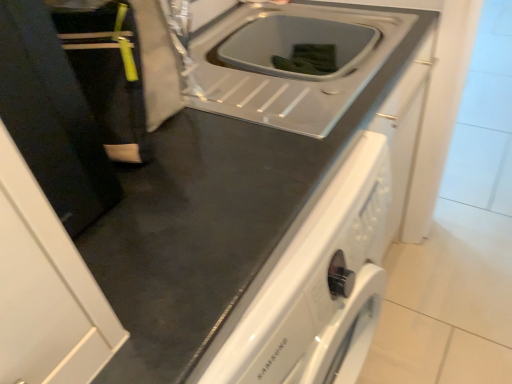
Identify the location of black fabric at left. The image size is (512, 384). (108, 74).

Locate an element on the screen. black fabric at left is located at coordinates (108, 74).

The width and height of the screenshot is (512, 384). In order to click on sink beneath the black fabric at left (from a real-world perspective) in this screenshot , I will do `click(292, 53)`.

Which object is thinner, black fabric at left or white glossy sink at center?

Thinner between the two is black fabric at left.

Would you say black fabric at left is inside or outside white glossy sink at center?

The correct answer is: outside.

Looking at this image, is black fabric at left oriented away from white glossy sink at center?

No, black fabric at left is not facing the opposite direction of white glossy sink at center.

In the image, is black matte door at left positioned in front of or behind black fabric at left?

black matte door at left is positioned closer to the viewer than black fabric at left.

Between black matte door at left and black fabric at left, which one has more height?

black matte door at left is taller.

Does black matte door at left turn towards black fabric at left?

No, black matte door at left does not turn towards black fabric at left.

Could black fabric at left be considered to be inside black matte door at left?

No, black fabric at left is located outside of black matte door at left.

Is black matte door at left to the left of white glossy sink at center from the viewer's perspective?

Yes.

From a real-world perspective, who is located higher, black matte door at left or white glossy sink at center?

black matte door at left is physically above.

Is black matte door at left smaller than white glossy sink at center?

Yes, black matte door at left is smaller than white glossy sink at center.

Is black matte door at left oriented towards white glossy sink at center?

No.

Which point is more distant from viewer, [95,90] or [24,157]?

The point [95,90] is more distant.

Visually, is black fabric at left positioned to the left or to the right of black matte door at left?

From the image, it's evident that black fabric at left is to the right of black matte door at left.

From a real-world perspective, is black fabric at left beneath black matte door at left?

Correct, in the physical world, black fabric at left is lower than black matte door at left.

Is black fabric at left further to the viewer compared to black matte door at left?

Yes, it is behind black matte door at left.

From the image's perspective, who appears lower, white glossy sink at center or black fabric at left?

black fabric at left is shown below in the image.

How different are the orientations of white glossy sink at center and black fabric at left in degrees?

The facing directions of white glossy sink at center and black fabric at left are 1.5 degrees apart.

Considering the relative sizes of white glossy sink at center and black fabric at left in the image provided, is white glossy sink at center taller than black fabric at left?

Incorrect, the height of white glossy sink at center is not larger of that of black fabric at left.

Which object is wider, white glossy sink at center or black fabric at left?

With larger width is white glossy sink at center.

Looking at this image, in terms of width, does white glossy sink at center look wider or thinner when compared to black matte door at left?

white glossy sink at center is wider than black matte door at left.

Is white glossy sink at center beside black matte door at left?

There is a gap between white glossy sink at center and black matte door at left.

Looking at this image, from a real-world perspective, is white glossy sink at center physically above black matte door at left?

No.

In the scene shown: How many degrees apart are the facing directions of white glossy sink at center and black matte door at left?

There is a 1.13-degree angle between the facing directions of white glossy sink at center and black matte door at left.

Identify the location of sink lying on the right of black fabric at left. (292, 53).

This screenshot has width=512, height=384. Find the location of `door that is in front of the black fabric at left`. door that is in front of the black fabric at left is located at coordinates (52, 117).

Based on their spatial positions, is black fabric at left or black matte door at left further from white glossy sink at center?

Based on the image, black matte door at left appears to be further to white glossy sink at center.

Estimate the real-world distances between objects in this image. Which object is further from black fabric at left, black matte door at left or white glossy sink at center?

Among the two, white glossy sink at center is located further to black fabric at left.

Looking at the image, which one is located closer to white glossy sink at center, black matte door at left or black fabric at left?

black fabric at left lies closer to white glossy sink at center than the other object.

Based on their spatial positions, is white glossy sink at center or black fabric at left closer to black matte door at left?

black fabric at left is closer to black matte door at left.

Based on their spatial positions, is black fabric at left or white glossy sink at center further from black matte door at left?

white glossy sink at center.

Considering their positions, is white glossy sink at center positioned closer to black fabric at left than black matte door at left?

black matte door at left lies closer to black fabric at left than the other object.

Where is `person between black matte door at left and white glossy sink at center from left to right`? person between black matte door at left and white glossy sink at center from left to right is located at coordinates (108, 74).